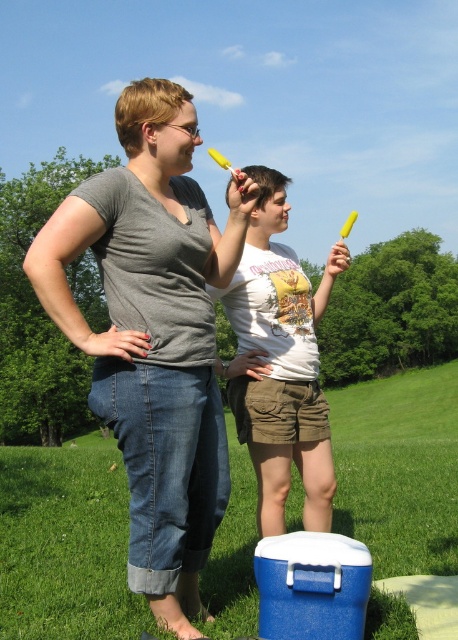
Who is positioned more to the left, matte gray shirt at center or green grass at lower center?

Positioned to the left is matte gray shirt at center.

Is matte gray shirt at center below green grass at lower center?

Actually, matte gray shirt at center is above green grass at lower center.

Does point (196, 630) lie behind point (34, 500)?

No, it is not.

Image resolution: width=458 pixels, height=640 pixels. What are the coordinates of `matte gray shirt at center` in the screenshot? It's located at (153, 333).

This screenshot has height=640, width=458. What do you see at coordinates (153, 333) in the screenshot?
I see `matte gray shirt at center` at bounding box center [153, 333].

Is point (163, 468) positioned after point (331, 468)?

That is False.

Image resolution: width=458 pixels, height=640 pixels. What are the coordinates of `matte gray shirt at center` in the screenshot? It's located at (153, 333).

Does green grass at lower center have a greater height compared to white cotton t-shirt at center?

Yes, green grass at lower center is taller than white cotton t-shirt at center.

Is green grass at lower center shorter than white cotton t-shirt at center?

Incorrect, green grass at lower center's height does not fall short of white cotton t-shirt at center's.

Is point (104, 564) closer to camera compared to point (307, 520)?

No, (104, 564) is behind (307, 520).

Identify the location of green grass at lower center. Image resolution: width=458 pixels, height=640 pixels. (65, 545).